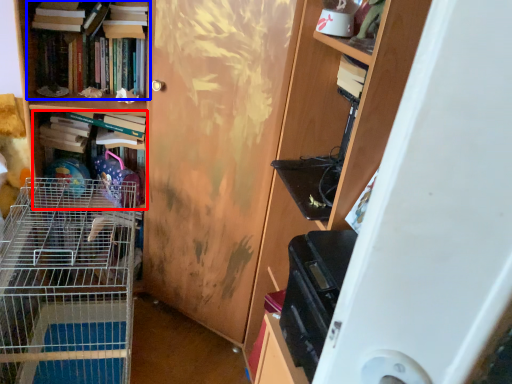
Question: Which of the following is the closest to the observer, book (highlighted by a red box) or book (highlighted by a blue box)?

Choices:
 (A) book
 (B) book

Answer: (B)